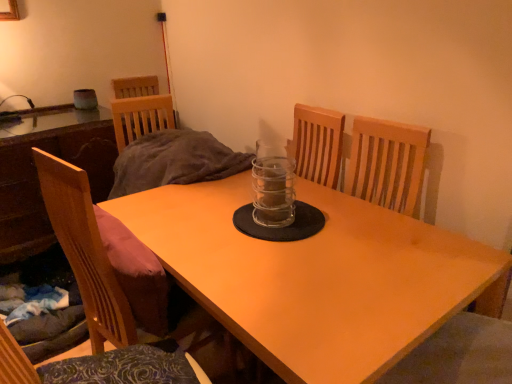
I want to click on vacant area that is situated to the right of transparent glass jar at center, so click(343, 220).